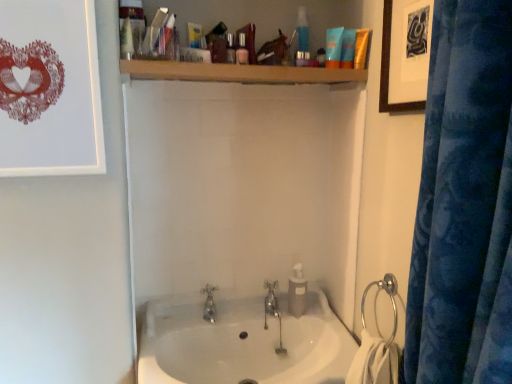
Question: Considering the relative sizes of white glossy sink at center and silver metallic towel ring at right in the image provided, is white glossy sink at center smaller than silver metallic towel ring at right?

Choices:
 (A) yes
 (B) no

Answer: (B)

Question: Is white glossy sink at center closer to camera compared to silver metallic towel ring at right?

Choices:
 (A) yes
 (B) no

Answer: (A)

Question: Is white glossy sink at center to the right of silver metallic towel ring at right from the viewer's perspective?

Choices:
 (A) no
 (B) yes

Answer: (A)

Question: Is white glossy sink at center located outside silver metallic towel ring at right?

Choices:
 (A) yes
 (B) no

Answer: (A)

Question: Would you say white glossy sink at center is a long distance from silver metallic towel ring at right?

Choices:
 (A) no
 (B) yes

Answer: (A)

Question: Looking at the image, does blue matte lotion at upper center, positioned as the 4th toiletry in bottom-to-top order, seem bigger or smaller compared to matte blue tube at upper center, which appears as the fourth toiletry when viewed from the front?

Choices:
 (A) big
 (B) small

Answer: (A)

Question: Considering their positions, is blue matte lotion at upper center, the 3th toiletry in the right-to-left sequence, located in front of or behind matte blue tube at upper center, the 2th toiletry when ordered from back to front?

Choices:
 (A) behind
 (B) front

Answer: (B)

Question: Is point (330, 54) closer or farther from the camera than point (349, 29)?

Choices:
 (A) farther
 (B) closer

Answer: (B)

Question: In terms of height, does blue matte lotion at upper center, arranged as the second toiletry when viewed from the top, look taller or shorter compared to matte blue tube at upper center, which is the second toiletry from right to left?

Choices:
 (A) short
 (B) tall

Answer: (B)

Question: Is wooden shelf at upper center bigger or smaller than silver metallic towel ring at right?

Choices:
 (A) small
 (B) big

Answer: (B)

Question: Is point (321, 77) closer or farther from the camera than point (394, 302)?

Choices:
 (A) closer
 (B) farther

Answer: (B)

Question: Would you say wooden shelf at upper center is to the left or to the right of silver metallic towel ring at right in the picture?

Choices:
 (A) left
 (B) right

Answer: (A)

Question: Considering the positions of wooden shelf at upper center and silver metallic towel ring at right in the image, is wooden shelf at upper center taller or shorter than silver metallic towel ring at right?

Choices:
 (A) short
 (B) tall

Answer: (B)

Question: Considering their positions, is wooden framed artwork at upper right, acting as the second picture frame starting from the left, located in front of or behind white glossy sink at center?

Choices:
 (A) behind
 (B) front

Answer: (B)

Question: Does point (394, 8) appear closer or farther from the camera than point (335, 326)?

Choices:
 (A) farther
 (B) closer

Answer: (B)